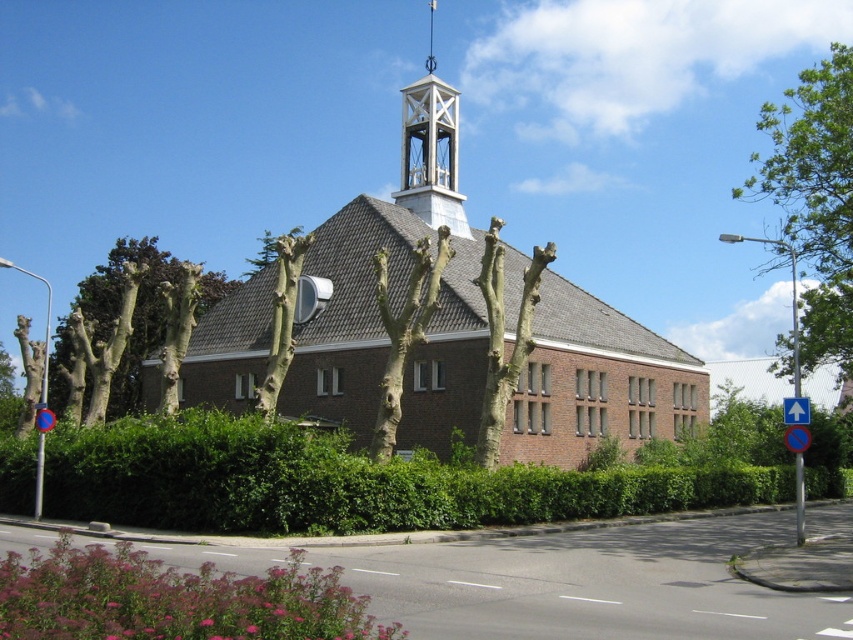
You are a gardener planning to trim the purple matte hedge at lower left and the bare branches at center. Based on their sizes, which one requires more time to trim?

The purple matte hedge at lower left requires less time to trim since it is smaller than the bare branches at center.

You are a landscape architect designing a new pathway that must pass between the bare branches at center and the blue circular sign at left. Given that the pathway needs to be at least 2 meters tall to allow trucks to pass through, will the existing height between these two objects be sufficient?

The bare branches at center has a greater height compared to blue circular sign at left. However, since the question specifies the pathway needs to be at least 2 meters tall for trucks, but the actual heights of the objects aren not provided in the description. Therefore, it is impossible to determine if the existing height is sufficient based on the given information.

You are a city planner evaluating the visibility of the blue circular sign at left from the street. Considering the presence of the bare bark tree at center, would the tree obstruct the view of the sign?

The bare bark tree at center is taller than the blue circular sign at left, so the tree may obstruct the view of the sign from the street.